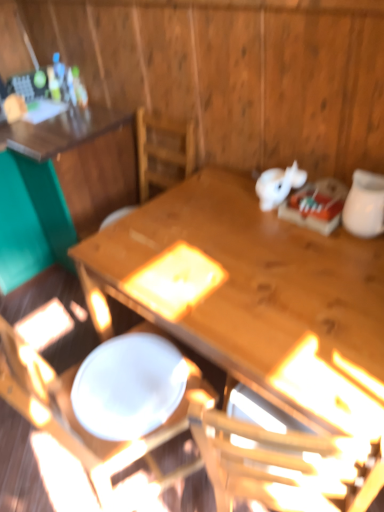
Locate an element on the screen. free spot in front of white glossy jar at upper right is located at coordinates (357, 262).